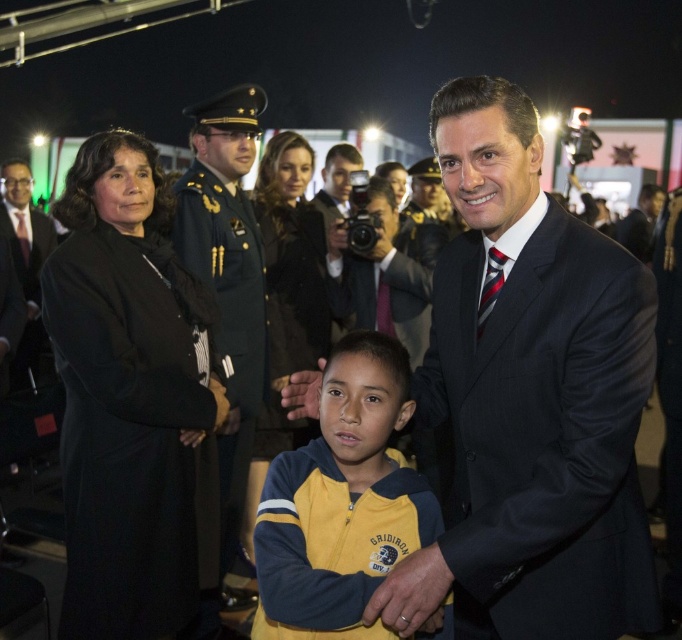
Question: Is dark blue pinstripe suit at center to the right of yellow fleece jacket at center from the viewer's perspective?

Choices:
 (A) no
 (B) yes

Answer: (B)

Question: Which object is positioned closest to the dark blue pinstripe suit at center?

Choices:
 (A) matte black suit at left
 (B) shiny dark blue uniform at center
 (C) black wool coat at left

Answer: (C)

Question: Does shiny dark blue uniform at center appear on the right side of matte black suit at left?

Choices:
 (A) no
 (B) yes

Answer: (B)

Question: Which is nearer to the matte black suit at left?

Choices:
 (A) shiny dark blue uniform at center
 (B) black wool coat at left

Answer: (A)

Question: Is dark blue pinstripe suit at center above black wool coat at left?

Choices:
 (A) yes
 (B) no

Answer: (A)

Question: Estimate the real-world distances between objects in this image. Which object is farther from the yellow fleece jacket at center?

Choices:
 (A) black wool coat at left
 (B) dark blue pinstripe suit at center
 (C) matte black suit at left
 (D) shiny dark blue uniform at center

Answer: (C)